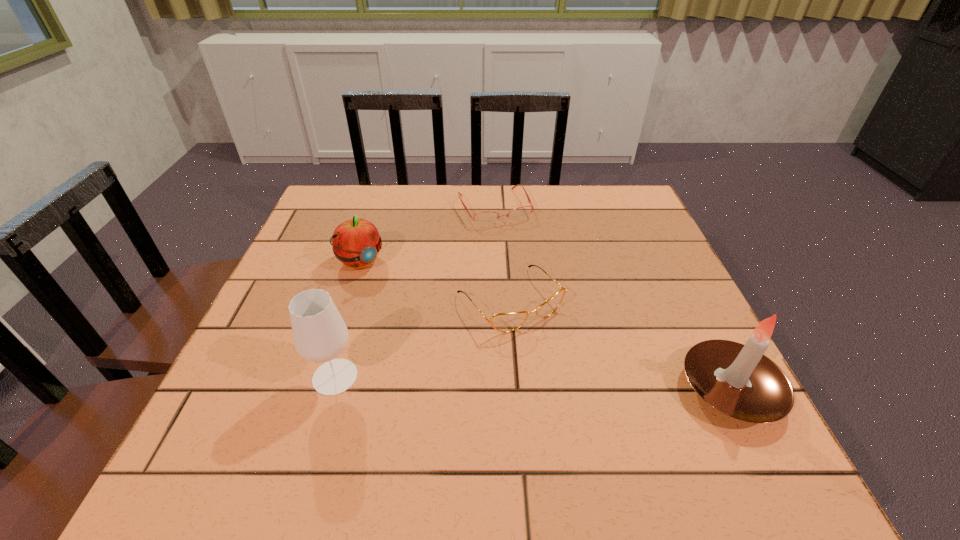
Where is `free spot on the desktop that is between the glass and the rightmost object and is positioned on the surface of the apple`? free spot on the desktop that is between the glass and the rightmost object and is positioned on the surface of the apple is located at coordinates (484, 381).

The width and height of the screenshot is (960, 540). In order to click on free space on the desktop that is between the glass and the candle and is positioned on the front-facing side of the fourth tallest object in this screenshot , I will do `click(582, 384)`.

Find the location of `vacant spot on the desktop that is between the glass and the candle and is positioned on the lenses of the farther spectacles`. vacant spot on the desktop that is between the glass and the candle and is positioned on the lenses of the farther spectacles is located at coordinates (589, 384).